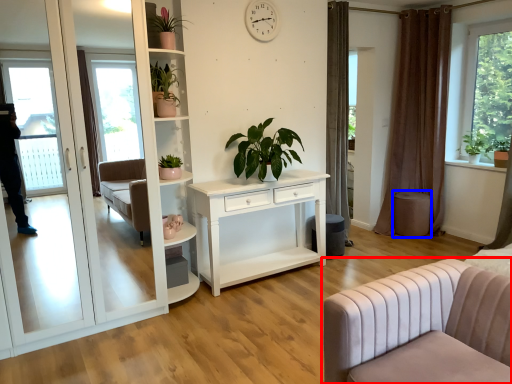
Question: Which point is closer to the camera, studio couch (highlighted by a red box) or stool (highlighted by a blue box)?

Choices:
 (A) studio couch
 (B) stool

Answer: (A)